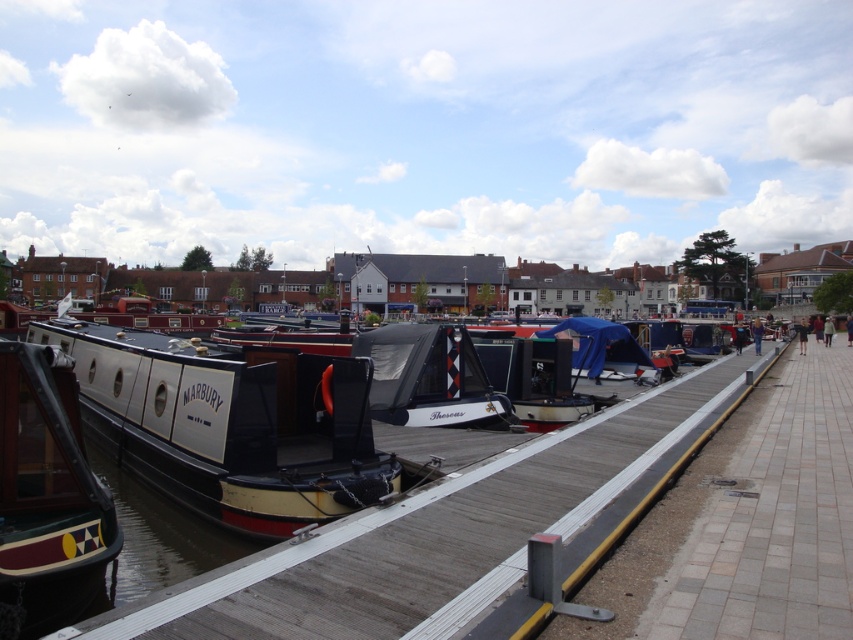
You are standing on the wooden dock at center and want to move to the maroon glossy boat at left. Which direction should you go to reach it?

The wooden dock at center is positioned on the right side of maroon glossy boat at left, so you should go to the left to reach the maroon glossy boat at left.